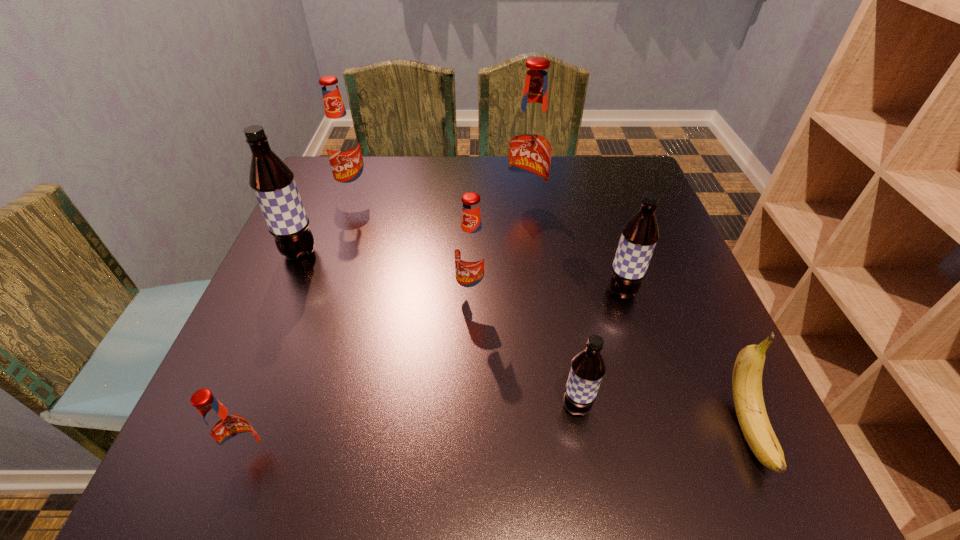
The width and height of the screenshot is (960, 540). Identify the location of the nearest root beer. (230, 433).

Identify the location of the nearest brown root beer. This screenshot has height=540, width=960. (587, 369).

Find the location of a particular element. This screenshot has height=540, width=960. the sixth farthest root beer is located at coordinates click(587, 369).

Image resolution: width=960 pixels, height=540 pixels. Find the location of `yellow banana`. yellow banana is located at coordinates (748, 398).

Locate an element on the screen. This screenshot has height=540, width=960. banana is located at coordinates (748, 398).

The height and width of the screenshot is (540, 960). I want to click on vacant area located 0.050m on the front of the tallest root beer, so click(x=528, y=233).

This screenshot has width=960, height=540. In order to click on vacant space situated on the front of the third smallest red root beer in this screenshot , I will do `click(347, 217)`.

You are a GUI agent. You are given a task and a screenshot of the screen. Output one action in this format:
    pyautogui.click(x=<x>, y=<y>)
    Task: Click on the free region located on the back of the biggest brown root beer
    The image size is (960, 540).
    Given the screenshot: What is the action you would take?
    pos(320,208)

Locate an element on the screen. vacant space situated on the right of the fourth root beer from right to left is located at coordinates (643, 293).

Identify the location of vacant point located 0.220m on the front of the second object from right to left. The width and height of the screenshot is (960, 540). (656, 403).